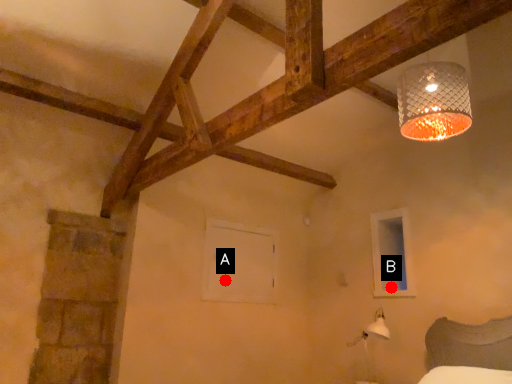
Question: Two points are circled on the image, labeled by A and B beside each circle. Which point appears closest to the camera in this image?

Choices:
 (A) A is closer
 (B) B is closer

Answer: (B)